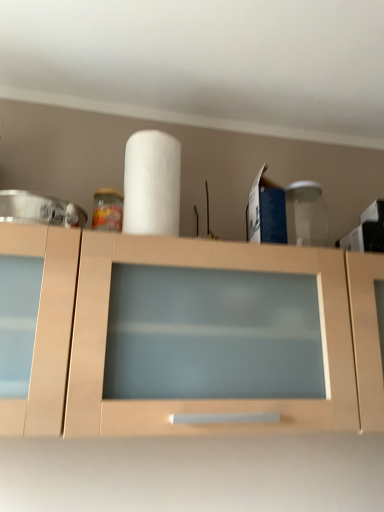
What do you see at coordinates (192, 270) in the screenshot? I see `matte wood cabinet at center` at bounding box center [192, 270].

At what (x,y) coordinates should I click in order to perform the action: click on matte wood cabinet at center. Please return your answer as a coordinate pair (x, y). Looking at the image, I should click on (192, 270).

The width and height of the screenshot is (384, 512). Identify the location of white matte paper towel at center. (152, 184).

Describe the element at coordinates (152, 184) in the screenshot. The height and width of the screenshot is (512, 384). I see `white matte paper towel at center` at that location.

This screenshot has width=384, height=512. I want to click on matte wood cabinet at center, so click(192, 270).

Does white matte paper towel at center appear on the left side of matte wood cabinet at center?

Correct, you'll find white matte paper towel at center to the left of matte wood cabinet at center.

Is the depth of white matte paper towel at center less than that of matte wood cabinet at center?

No, it is not.

Is point (132, 196) closer or farther from the camera than point (367, 428)?

Point (132, 196) appears to be farther away from the viewer than point (367, 428).

From the image's perspective, is white matte paper towel at center below matte wood cabinet at center?

No, from the image's perspective, white matte paper towel at center is not below matte wood cabinet at center.

From a real-world perspective, is white matte paper towel at center above or below matte wood cabinet at center?

white matte paper towel at center is situated higher than matte wood cabinet at center in the real world.

Which object is wider, white matte paper towel at center or matte wood cabinet at center?

matte wood cabinet at center is wider.

Does white matte paper towel at center have a lesser height compared to matte wood cabinet at center?

Correct, white matte paper towel at center is not as tall as matte wood cabinet at center.

Is white matte paper towel at center bigger than matte wood cabinet at center?

No, white matte paper towel at center is not bigger than matte wood cabinet at center.

Is matte wood cabinet at center completely or partially inside white matte paper towel at center?

Actually, matte wood cabinet at center is outside white matte paper towel at center.

From the picture: Is white matte paper towel at center positioned far away from matte wood cabinet at center?

No, there isn't a large distance between white matte paper towel at center and matte wood cabinet at center.

Is white matte paper towel at center looking in the opposite direction of matte wood cabinet at center?

No, white matte paper towel at center is not facing away from matte wood cabinet at center.

The image size is (384, 512). In order to click on paper towel behind the matte wood cabinet at center in this screenshot , I will do `click(152, 184)`.

Considering the positions of objects matte wood cabinet at center and white matte paper towel at center in the image provided, who is more to the right, matte wood cabinet at center or white matte paper towel at center?

matte wood cabinet at center.

Which object is further away from the camera, matte wood cabinet at center or white matte paper towel at center?

Positioned behind is white matte paper towel at center.

Considering the points (261, 411) and (175, 164), which point is behind, point (261, 411) or point (175, 164)?

The point (175, 164) is more distant.

From the image's perspective, which one is positioned higher, matte wood cabinet at center or white matte paper towel at center?

white matte paper towel at center, from the image's perspective.

From a real-world perspective, is matte wood cabinet at center under white matte paper towel at center?

Yes.

Can you confirm if matte wood cabinet at center is wider than white matte paper towel at center?

Correct, the width of matte wood cabinet at center exceeds that of white matte paper towel at center.

Does matte wood cabinet at center have a greater height compared to white matte paper towel at center?

Yes, matte wood cabinet at center is taller than white matte paper towel at center.

In terms of size, does matte wood cabinet at center appear bigger or smaller than white matte paper towel at center?

Clearly, matte wood cabinet at center is larger in size than white matte paper towel at center.

Is matte wood cabinet at center not inside white matte paper towel at center?

Yes.

Is matte wood cabinet at center next to white matte paper towel at center and touching it?

No.

Is matte wood cabinet at center looking in the opposite direction of white matte paper towel at center?

matte wood cabinet at center does not have its back to white matte paper towel at center.

Can you tell me how much matte wood cabinet at center and white matte paper towel at center differ in facing direction?

The angular difference between matte wood cabinet at center and white matte paper towel at center is 0.00517 degrees.

Measure the distance between matte wood cabinet at center and white matte paper towel at center.

matte wood cabinet at center is 9.57 inches from white matte paper towel at center.

At what (x,y) coordinates should I click in order to perform the action: click on paper towel behind the matte wood cabinet at center. Please return your answer as a coordinate pair (x, y). This screenshot has width=384, height=512. Looking at the image, I should click on (152, 184).

Locate an element on the screen. cabinetry below the white matte paper towel at center (from the image's perspective) is located at coordinates (192, 270).

Where is `cabinetry below the white matte paper towel at center (from a real-world perspective)`? cabinetry below the white matte paper towel at center (from a real-world perspective) is located at coordinates (192, 270).